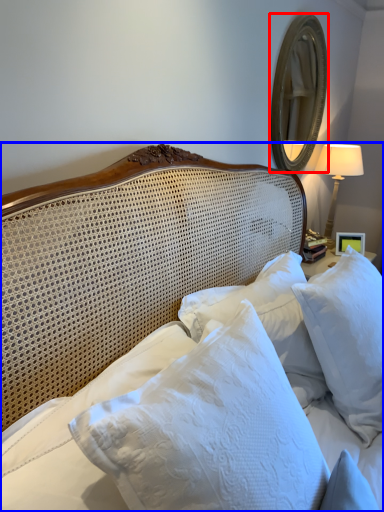
Question: Which of the following is the farthest to the observer, mirror (highlighted by a red box) or bed (highlighted by a blue box)?

Choices:
 (A) mirror
 (B) bed

Answer: (A)